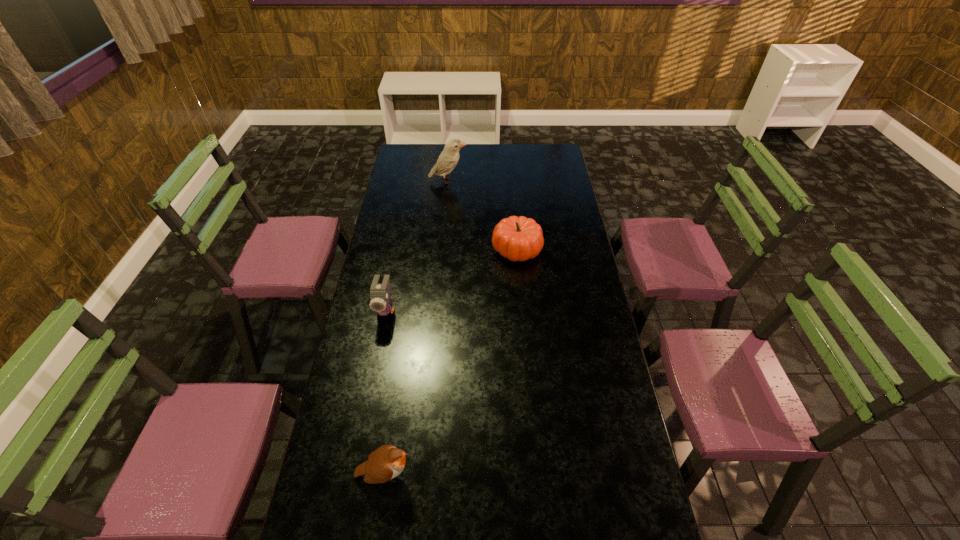
Identify the location of empty space between the second nearest bird and the tallest bird. The image size is (960, 540). (417, 245).

Identify the location of unoccupied position between the second nearest object and the nearest bird. (386, 392).

Where is `free point between the pumpkin and the farthest object`? The image size is (960, 540). free point between the pumpkin and the farthest object is located at coordinates (482, 215).

Select which object appears as the third closest to the second nearest bird. Please provide its 2D coordinates. Your answer should be formatted as a tuple, i.e. [(x, y)], where the tuple contains the x and y coordinates of a point satisfying the conditions above.

[(449, 157)]

Identify which object is the nearest to the nearest object. Please provide its 2D coordinates. Your answer should be formatted as a tuple, i.e. [(x, y)], where the tuple contains the x and y coordinates of a point satisfying the conditions above.

[(380, 301)]

Where is `bird that is the closest one to the pumpkin`? bird that is the closest one to the pumpkin is located at coordinates (449, 157).

Select which bird appears as the closest to the nearest bird. Please provide its 2D coordinates. Your answer should be formatted as a tuple, i.e. [(x, y)], where the tuple contains the x and y coordinates of a point satisfying the conditions above.

[(380, 301)]

Find the location of `free location that satisfies the following two spatial constraints: 1. on the front side of the pumpkin; 2. at the face of the nearest object`. free location that satisfies the following two spatial constraints: 1. on the front side of the pumpkin; 2. at the face of the nearest object is located at coordinates (536, 474).

Find the location of a particular element. free space that satisfies the following two spatial constraints: 1. at the face of the tallest object; 2. at the beak of the second nearest object is located at coordinates (437, 309).

The image size is (960, 540). What are the coordinates of `vacant space that satisfies the following two spatial constraints: 1. at the face of the tallest object; 2. on the back side of the rightmost object` in the screenshot? It's located at click(x=442, y=249).